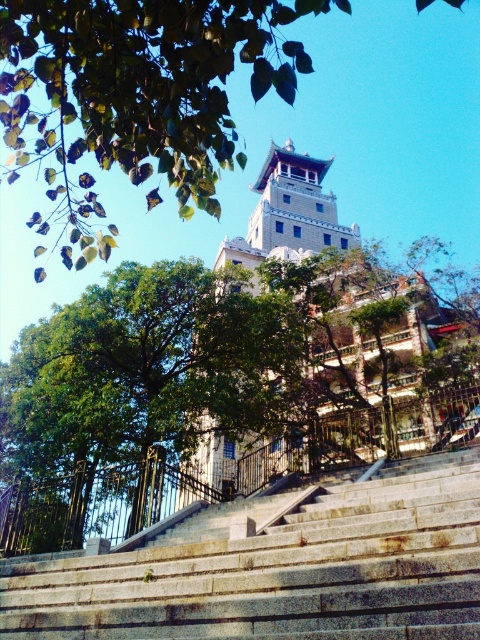
You are a tour guide leading a group up the gray stone stairs at center towards the green leafy tree at upper center. The path between them is 31.20 meters. If your group walks at a pace of 1.5 meters per second, how many seconds will it take them to reach the tree?

The distance between the gray stone stairs at center and the green leafy tree at upper center is 31.20 meters. At a walking speed of 1.5 meters per second, the time required would be 31.20 divided by 1.5, which equals 20.8 seconds. Therefore, it will take approximately 20.8 seconds for the group to reach the tree.

You are standing at the bottom of the stone steps and looking up at the pagoda. Which green leafy tree is positioned to the left when comparing the green leafy tree at center and the green leafy tree at upper center?

The green leafy tree at center is to the left of the green leafy tree at upper center.

You are standing at the base of the stone steps leading to the pagoda. You want to walk towards the building. Which point, point (412, 506) or point (265, 381), is closer to you as you face the pagoda?

Point (412, 506) is in front of point (265, 381), so it is closer to you as you face the pagoda.